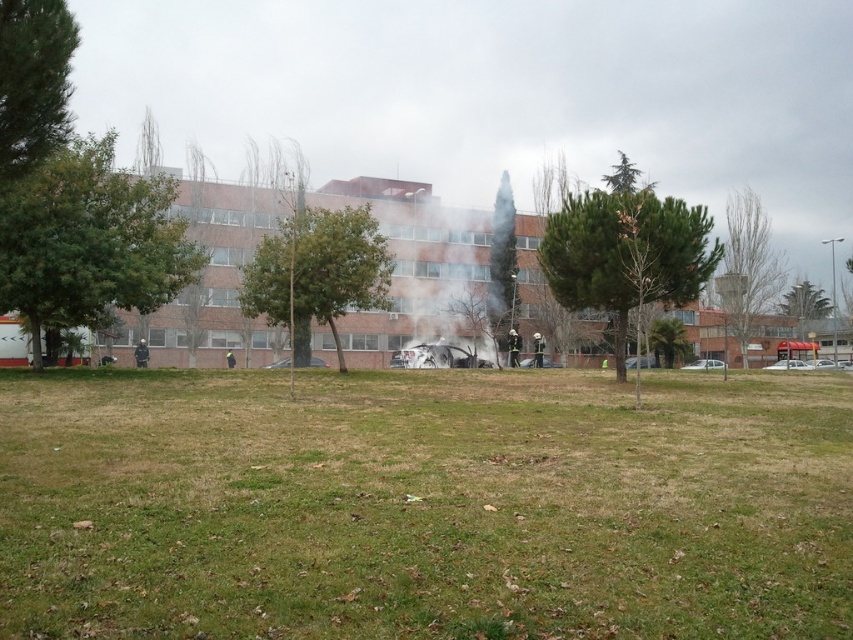
Question: Does green grass at center have a lesser width compared to green leafy tree at upper center?

Choices:
 (A) no
 (B) yes

Answer: (A)

Question: Which point appears closest to the camera in this image?

Choices:
 (A) (825, 307)
 (B) (621, 230)
 (C) (334, 273)

Answer: (B)

Question: Is green leafy tree at center to the right of bare branches at right from the viewer's perspective?

Choices:
 (A) no
 (B) yes

Answer: (A)

Question: Estimate the real-world distances between objects in this image. Which object is farther from the green leafy tree at center?

Choices:
 (A) green leafy tree at left
 (B) green leafy tree at upper left
 (C) green textured tree at center
 (D) green leafy tree at upper center

Answer: (D)

Question: Which point is farther to the camera?

Choices:
 (A) (329, 307)
 (B) (12, 16)

Answer: (A)

Question: Is green textured tree at center to the right of green leafy tree at center from the viewer's perspective?

Choices:
 (A) yes
 (B) no

Answer: (A)